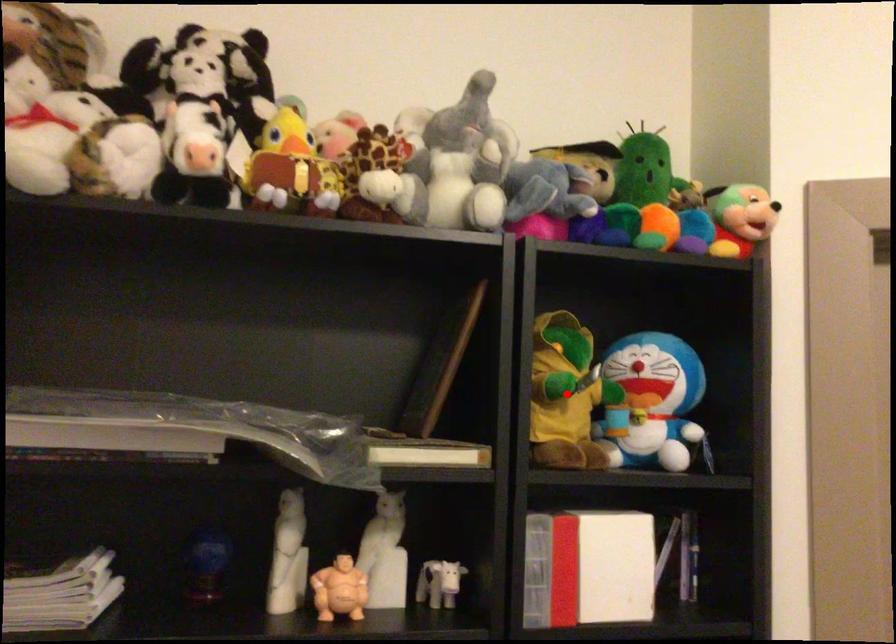
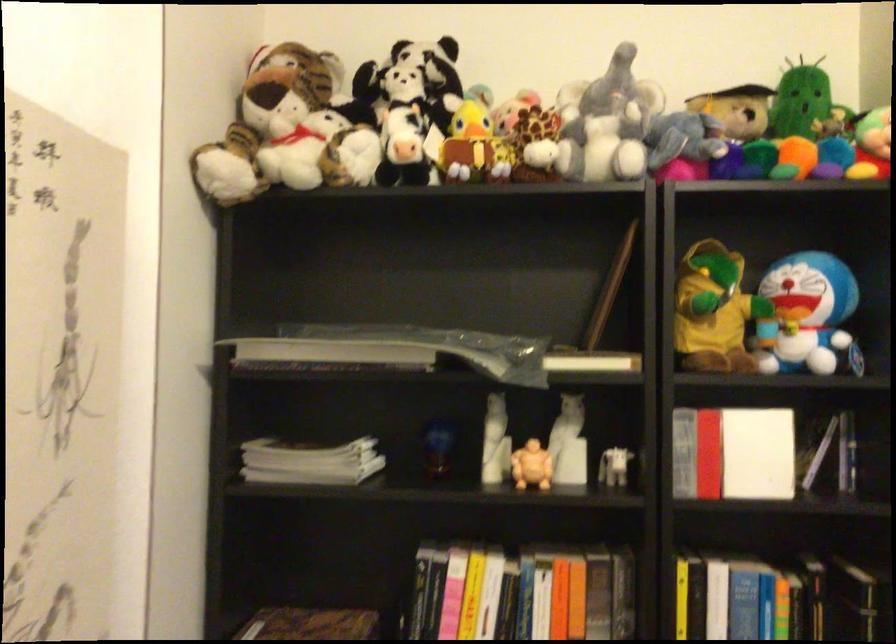
Question: I am providing you with two images of the same scene from different viewpoints. Image1 has a red point marked. In image2, the corresponding 3D location appears at what relative position? Reply with the corresponding letter.

Choices:
 (A) Closer
 (B) Farther

Answer: (B)